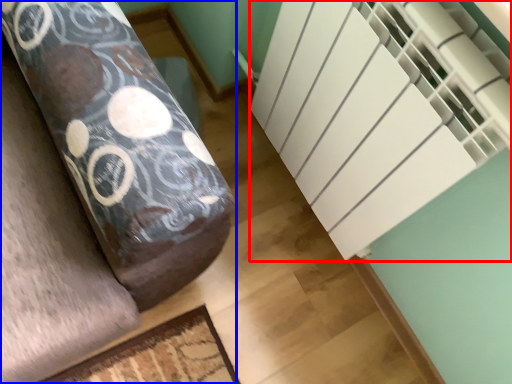
Question: Which point is closer to the camera, stairwell (highlighted by a red box) or furniture (highlighted by a blue box)?

Choices:
 (A) stairwell
 (B) furniture

Answer: (A)